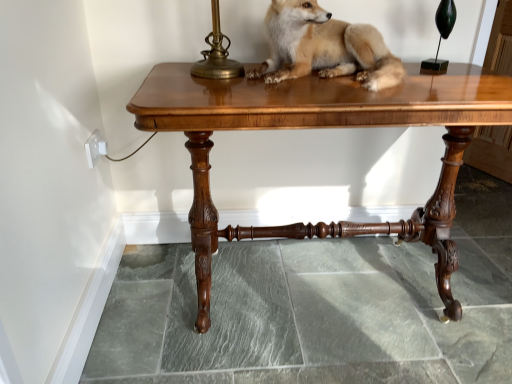
Question: Does shiny brass table lamp at upper right have a lesser height compared to glossy wood table at center?

Choices:
 (A) yes
 (B) no

Answer: (A)

Question: Considering the relative positions of shiny brass table lamp at upper right and glossy wood table at center in the image provided, is shiny brass table lamp at upper right to the right of glossy wood table at center from the viewer's perspective?

Choices:
 (A) yes
 (B) no

Answer: (A)

Question: From a real-world perspective, is shiny brass table lamp at upper right on top of glossy wood table at center?

Choices:
 (A) yes
 (B) no

Answer: (A)

Question: Is shiny brass table lamp at upper right positioned far away from glossy wood table at center?

Choices:
 (A) no
 (B) yes

Answer: (A)

Question: Is shiny brass table lamp at upper right not inside glossy wood table at center?

Choices:
 (A) yes
 (B) no

Answer: (A)

Question: Visually, is light brown fur at center positioned to the left or to the right of shiny brass table lamp at upper right?

Choices:
 (A) left
 (B) right

Answer: (A)

Question: Considering their positions, is light brown fur at center located in front of or behind shiny brass table lamp at upper right?

Choices:
 (A) behind
 (B) front

Answer: (B)

Question: Is light brown fur at center wider or thinner than shiny brass table lamp at upper right?

Choices:
 (A) thin
 (B) wide

Answer: (B)

Question: From the image's perspective, is light brown fur at center above or below shiny brass table lamp at upper right?

Choices:
 (A) above
 (B) below

Answer: (B)

Question: Relative to light brown fur at center, is glossy wood table at center in front or behind?

Choices:
 (A) behind
 (B) front

Answer: (B)

Question: Is glossy wood table at center inside or outside of light brown fur at center?

Choices:
 (A) outside
 (B) inside

Answer: (A)

Question: In the image, is glossy wood table at center on the left side or the right side of light brown fur at center?

Choices:
 (A) left
 (B) right

Answer: (A)

Question: From the image's perspective, is glossy wood table at center positioned above or below light brown fur at center?

Choices:
 (A) above
 (B) below

Answer: (B)

Question: Is point (207, 160) closer or farther from the camera than point (443, 62)?

Choices:
 (A) farther
 (B) closer

Answer: (B)

Question: From a real-world perspective, is glossy wood table at center positioned above or below shiny brass table lamp at upper right?

Choices:
 (A) below
 (B) above

Answer: (A)